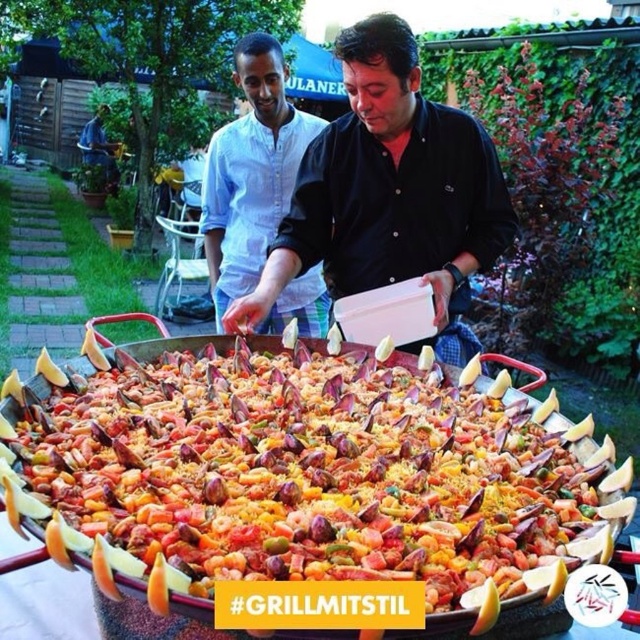
Can you confirm if multicolored rice at center is positioned above black matte shirt at center?

Actually, multicolored rice at center is below black matte shirt at center.

Does multicolored rice at center have a greater height compared to black matte shirt at center?

No.

Between point (298, 632) and point (294, 230), which one is positioned in front?

Positioned in front is point (298, 632).

Identify the location of multicolored rice at center. (307, 476).

Does black matte shirt at center have a lesser width compared to light blue cotton shirt at center?

Incorrect, black matte shirt at center's width is not less than light blue cotton shirt at center's.

Can you confirm if black matte shirt at center is taller than light blue cotton shirt at center?

No.

Who is more distant from viewer, (276, 266) or (285, 195)?

Point (285, 195)

The image size is (640, 640). Identify the location of black matte shirt at center. (390, 193).

Can you confirm if multicolored rice at center is positioned below light blue cotton shirt at center?

Correct, multicolored rice at center is located below light blue cotton shirt at center.

Is multicolored rice at center positioned behind light blue cotton shirt at center?

No, multicolored rice at center is in front of light blue cotton shirt at center.

Describe the element at coordinates (307, 476) in the screenshot. I see `multicolored rice at center` at that location.

This screenshot has height=640, width=640. I want to click on multicolored rice at center, so click(x=307, y=476).